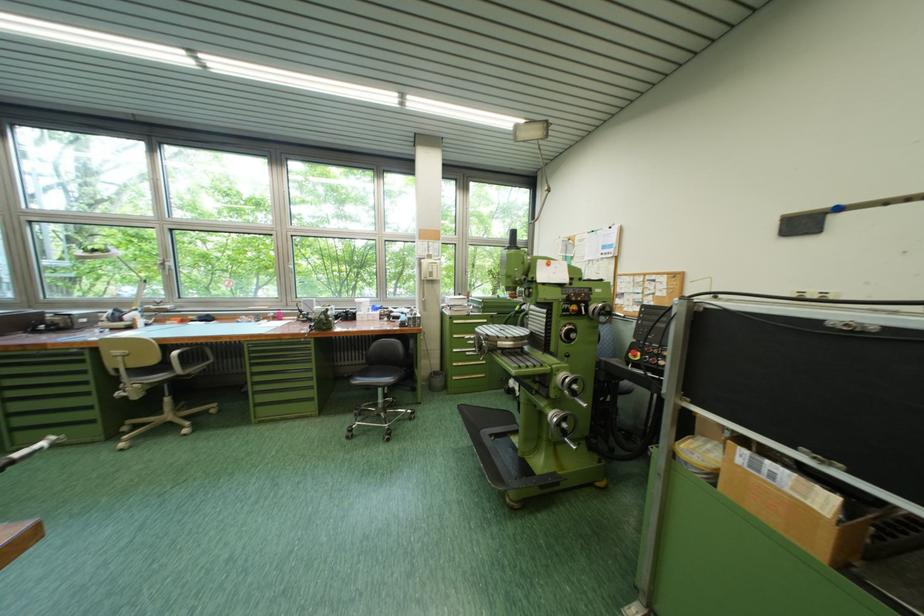
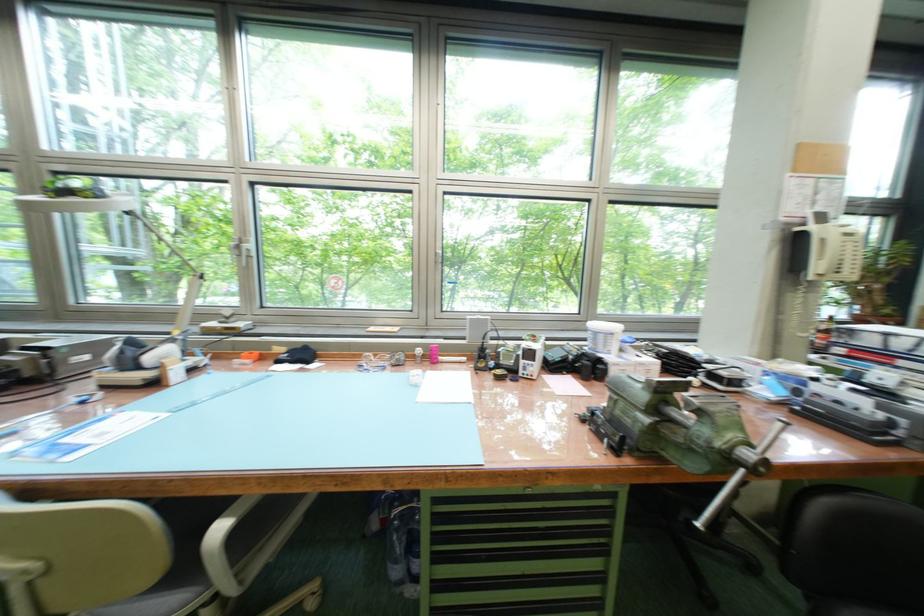
What movement of the cameraman would produce the second image?

The cameraman walked toward left, forward.